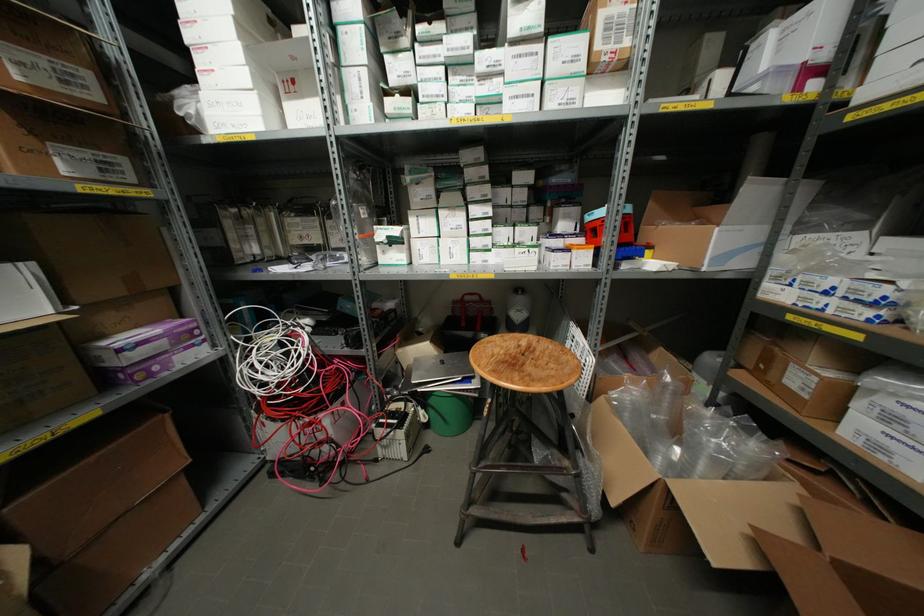
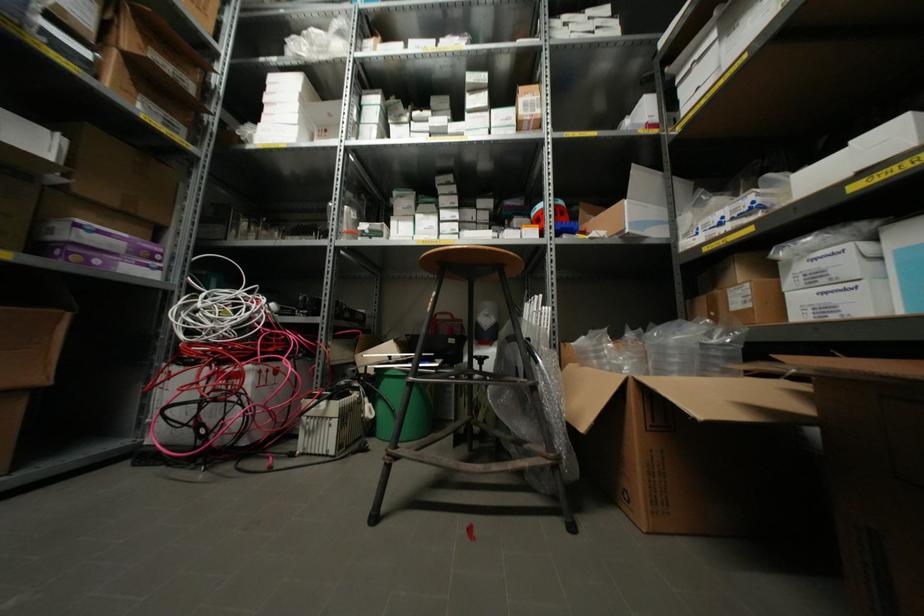
Where in the second image is the point corresponding to (x=242, y=74) from the first image?

(293, 116)